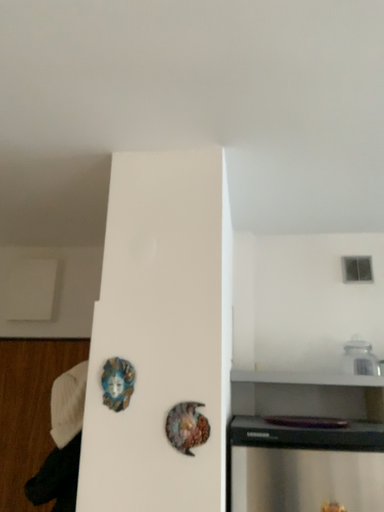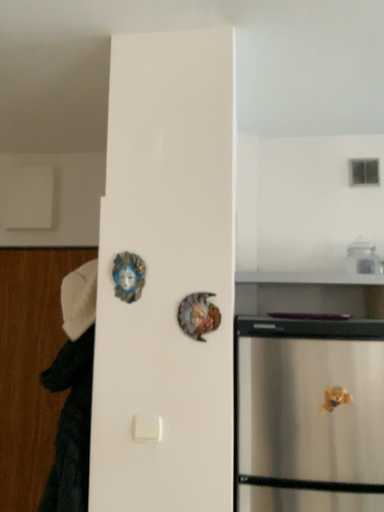
Question: Which way did the camera rotate in the video?

Choices:
 (A) rotated downward
 (B) rotated upward

Answer: (A)